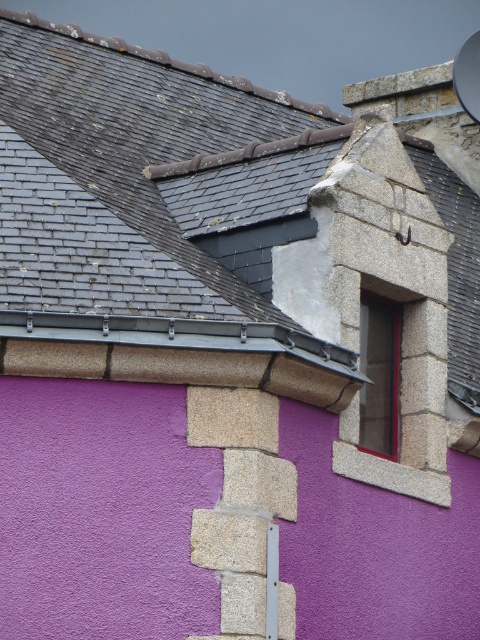
Describe the element at coordinates (163, 166) in the screenshot. This screenshot has width=480, height=640. I see `gray slate roof at upper left` at that location.

Who is positioned more to the left, gray slate roof at upper left or smooth stone window at upper right?

gray slate roof at upper left

What do you see at coordinates (163, 166) in the screenshot?
I see `gray slate roof at upper left` at bounding box center [163, 166].

Image resolution: width=480 pixels, height=640 pixels. In order to click on gray slate roof at upper left in this screenshot , I will do `click(163, 166)`.